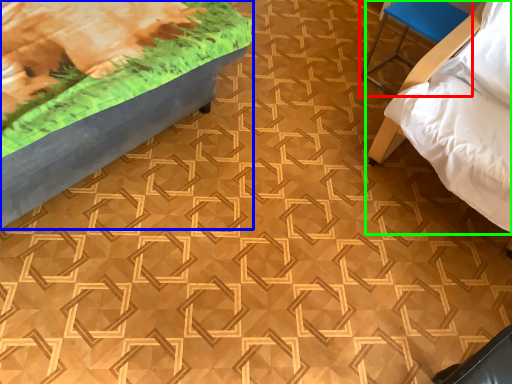
Question: Which object is the closest to the furniture (highlighted by a red box)? Choose among these: furniture (highlighted by a blue box) or furniture (highlighted by a green box).

Choices:
 (A) furniture
 (B) furniture

Answer: (B)